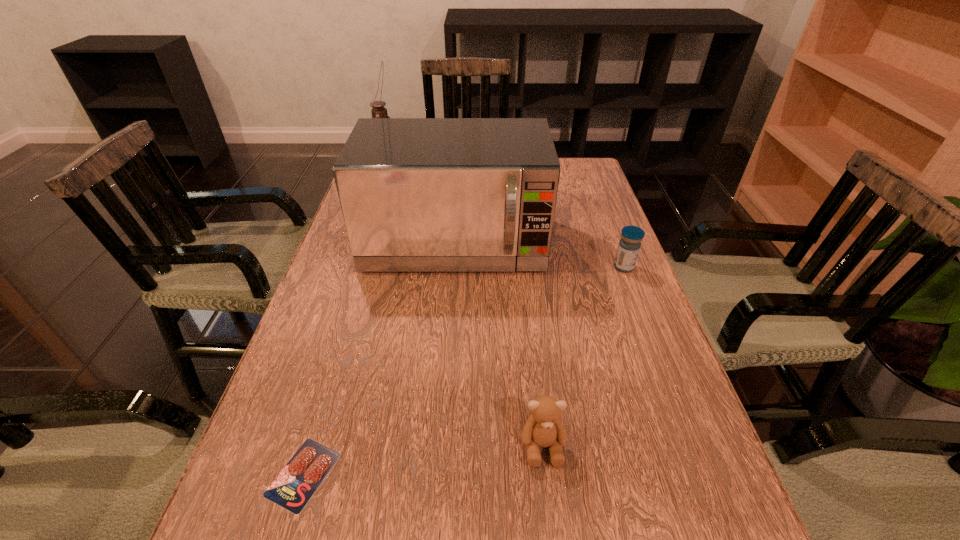
The height and width of the screenshot is (540, 960). What are the coordinates of `the closest object to the microwave oven` in the screenshot? It's located at (629, 246).

Where is `free space that satisfies the following two spatial constraints: 1. with the door open on the microwave oven; 2. on the left side of the rightmost object`? The width and height of the screenshot is (960, 540). free space that satisfies the following two spatial constraints: 1. with the door open on the microwave oven; 2. on the left side of the rightmost object is located at coordinates [453, 267].